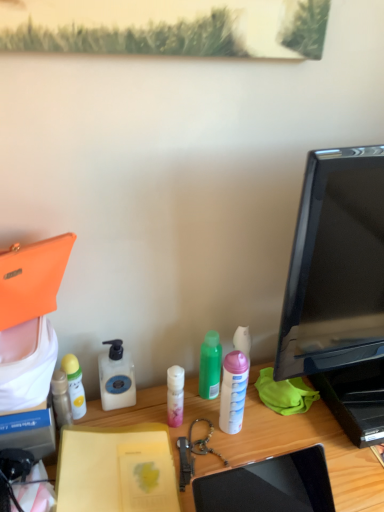
The height and width of the screenshot is (512, 384). I want to click on vacant area that is situated to the right of white matte bottle at center, the third bottle viewed from the right, so (169, 403).